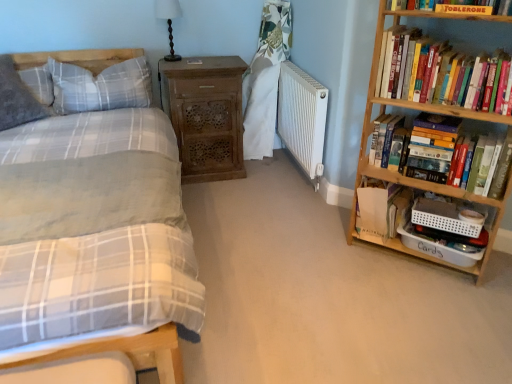
The height and width of the screenshot is (384, 512). I want to click on vacant space underneath white fabric curtain at center (from a real-world perspective), so click(x=259, y=158).